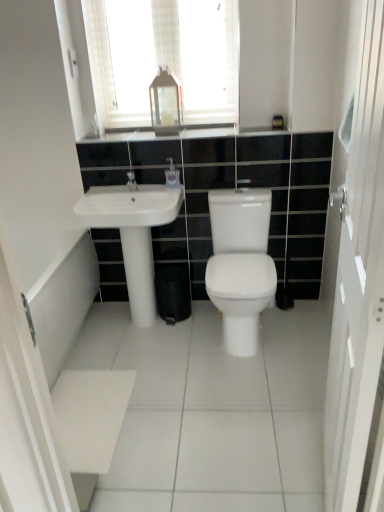
Locate an element on the screen. The height and width of the screenshot is (512, 384). vacant area situated below white glossy sink at left (from a real-world perspective) is located at coordinates (124, 323).